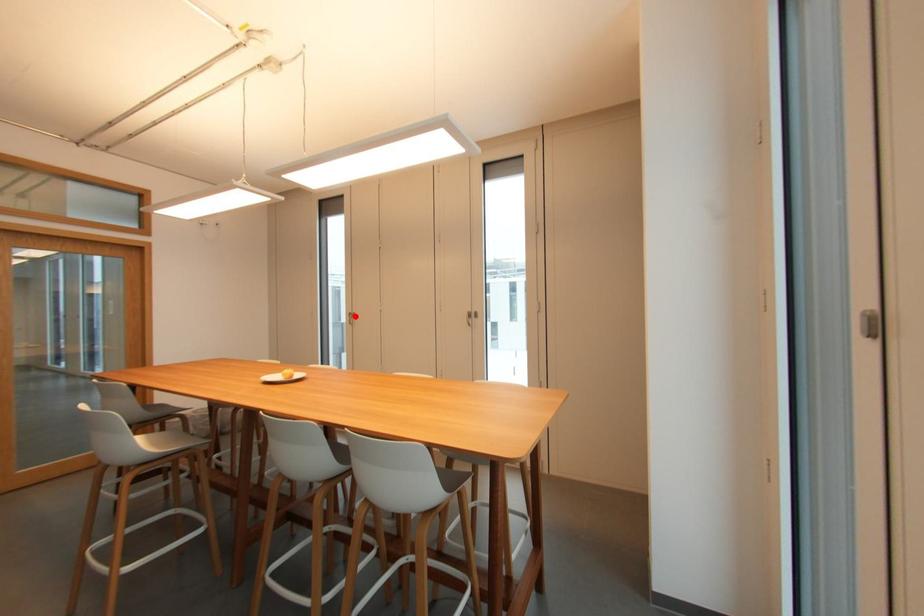
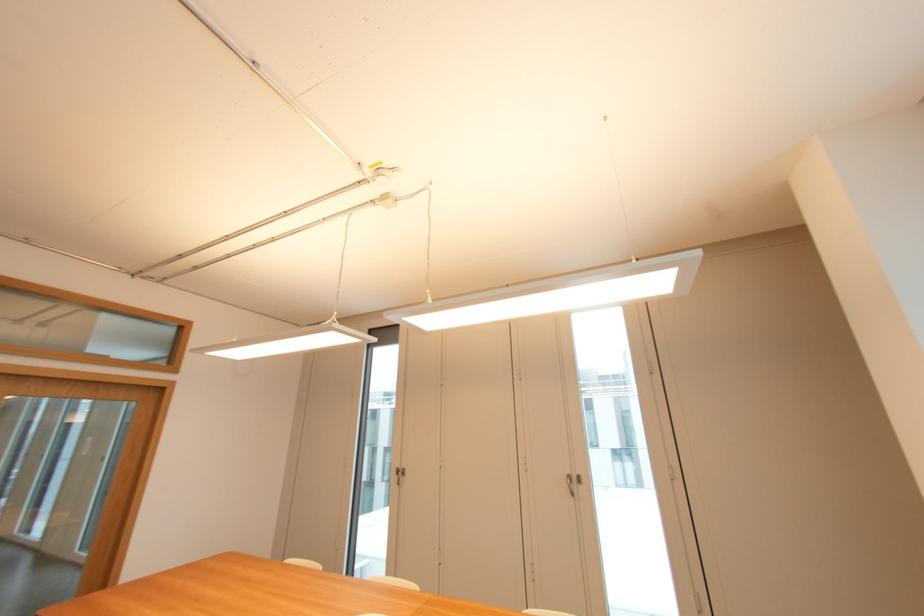
The point at the highlighted location is marked in the first image. Where is the corresponding point in the second image?

(405, 472)